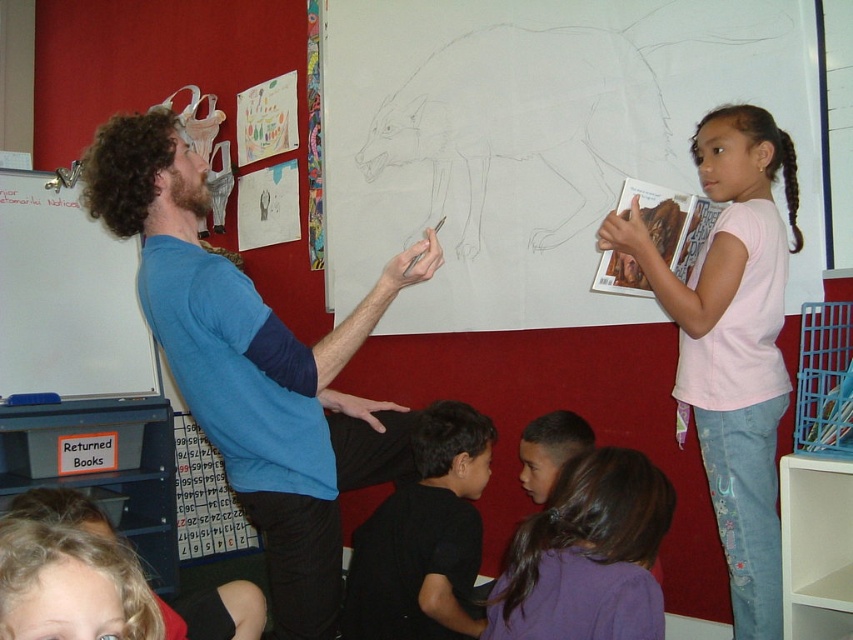
Question: Which point appears farthest from the camera in this image?

Choices:
 (A) (795, 177)
 (B) (289, 572)
 (C) (120, 241)

Answer: (C)

Question: Based on their relative distances, which object is farther from the purple fabric hair at lower center?

Choices:
 (A) blue t-shirt at upper left
 (B) pink cotton shirt at upper right

Answer: (B)

Question: Considering the relative positions of pink cotton shirt at upper right and whiteboard at left in the image provided, where is pink cotton shirt at upper right located with respect to whiteboard at left?

Choices:
 (A) above
 (B) below

Answer: (B)

Question: Does pink cotton shirt at upper right appear under black matte shirt at lower center?

Choices:
 (A) yes
 (B) no

Answer: (B)

Question: Which of the following is the farthest from the observer?

Choices:
 (A) (384, 557)
 (B) (587, 476)
 (C) (134, 362)

Answer: (C)

Question: From the image, what is the correct spatial relationship of blue t-shirt at upper left in relation to black matte shirt at lower center?

Choices:
 (A) left
 (B) right

Answer: (A)